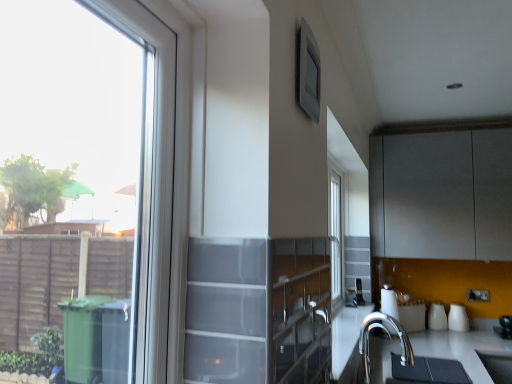
Measure the distance between matte gray cabinet at upper right and camera.

A distance of 2.88 meters exists between matte gray cabinet at upper right and camera.

What do you see at coordinates (359, 292) in the screenshot? I see `satin silver toaster at lower center, acting as the 3th appliance starting from the right` at bounding box center [359, 292].

At what (x,y) coordinates should I click in order to perform the action: click on polished chrome faucet at lower right. Please return your answer as a coordinate pair (x, y). Image resolution: width=512 pixels, height=384 pixels. Looking at the image, I should click on (389, 335).

Describe the element at coordinates (308, 72) in the screenshot. I see `matte gray window screen at upper center` at that location.

From the picture: How much space does white glossy vase at right, marked as the first appliance in a right-to-left arrangement, occupy vertically?

It is 8.68 inches.

What are the coordinates of `matte gray cabinet at upper right` in the screenshot? It's located at (442, 190).

Is matte gray window screen at upper center directly adjacent to white glossy vase at right, the 3th appliance when ordered from left to right?

No, matte gray window screen at upper center is not making contact with white glossy vase at right, the 3th appliance when ordered from left to right.

Could you tell me if matte gray window screen at upper center is turned towards white glossy vase at right, the 3th appliance when ordered from left to right?

No, matte gray window screen at upper center is not aimed at white glossy vase at right, the 3th appliance when ordered from left to right.

From a real-world perspective, is matte gray window screen at upper center positioned over white glossy vase at right, marked as the first appliance in a right-to-left arrangement, based on gravity?

Correct, in the physical world, matte gray window screen at upper center is higher than white glossy vase at right, marked as the first appliance in a right-to-left arrangement.

Considering the relative sizes of matte gray window screen at upper center and white glossy vase at right, marked as the first appliance in a right-to-left arrangement, in the image provided, is matte gray window screen at upper center wider than white glossy vase at right, marked as the first appliance in a right-to-left arrangement,?

No.

Between satin silver toaster at lower center, which is the 1th appliance from left to right, and clear glass window at left, which one has less height?

With less height is satin silver toaster at lower center, which is the 1th appliance from left to right.

Does satin silver toaster at lower center, acting as the 3th appliance starting from the right, come behind clear glass window at left?

Yes, it is behind clear glass window at left.

From the image's perspective, which one is positioned higher, satin silver toaster at lower center, which is the 1th appliance from left to right, or clear glass window at left?

clear glass window at left.

Is satin silver toaster at lower center, which is the 1th appliance from left to right, at the right side of clear glass window at left?

Yes, satin silver toaster at lower center, which is the 1th appliance from left to right, is to the right of clear glass window at left.

From a real-world perspective, between white glossy cups at lower right, placed as the second appliance when sorted from right to left, and satin silver toaster at lower center, acting as the 3th appliance starting from the right, who is vertically lower?

white glossy cups at lower right, placed as the second appliance when sorted from right to left, is physically lower.

Between white glossy cups at lower right, placed as the second appliance when sorted from right to left, and satin silver toaster at lower center, which is the 1th appliance from left to right, which one has larger width?

white glossy cups at lower right, placed as the second appliance when sorted from right to left.

Is white glossy cups at lower right, placed as the second appliance when sorted from right to left, not near satin silver toaster at lower center, acting as the 3th appliance starting from the right?

No.

Would you say white glossy cups at lower right, placed as the second appliance when sorted from right to left, contains satin silver toaster at lower center, which is the 1th appliance from left to right?

No, satin silver toaster at lower center, which is the 1th appliance from left to right, is not surrounded by white glossy cups at lower right, placed as the second appliance when sorted from right to left.

Between clear glass window at left and matte gray window screen at upper center, which one has larger width?

With larger width is clear glass window at left.

From a real-world perspective, does clear glass window at left sit lower than matte gray window screen at upper center?

Correct, in the physical world, clear glass window at left is lower than matte gray window screen at upper center.

Is clear glass window at left taller or shorter than matte gray window screen at upper center?

Considering their sizes, clear glass window at left has more height than matte gray window screen at upper center.

Is clear glass window at left next to matte gray window screen at upper center?

They are not placed beside each other.

Does white glossy vase at right, the 3th appliance when ordered from left to right, have a larger size compared to matte gray window screen at upper center?

Yes.

How different are the orientations of white glossy vase at right, the 3th appliance when ordered from left to right, and matte gray window screen at upper center in degrees?

91.2 degrees separate the facing orientations of white glossy vase at right, the 3th appliance when ordered from left to right, and matte gray window screen at upper center.

Which object is positioned more to the right, white glossy vase at right, the 3th appliance when ordered from left to right, or matte gray window screen at upper center?

white glossy vase at right, the 3th appliance when ordered from left to right.

Would you say white glossy vase at right, the 3th appliance when ordered from left to right, is inside or outside matte gray window screen at upper center?

white glossy vase at right, the 3th appliance when ordered from left to right, is spatially situated outside matte gray window screen at upper center.

Is satin silver toaster at lower center, which is the 1th appliance from left to right, bigger than white glossy vase at right, marked as the first appliance in a right-to-left arrangement?

Incorrect, satin silver toaster at lower center, which is the 1th appliance from left to right, is not larger than white glossy vase at right, marked as the first appliance in a right-to-left arrangement.

This screenshot has width=512, height=384. I want to click on appliance in front of the white glossy vase at right, the 3th appliance when ordered from left to right, so click(x=359, y=292).

Is satin silver toaster at lower center, which is the 1th appliance from left to right, facing towards white glossy vase at right, marked as the first appliance in a right-to-left arrangement?

No, satin silver toaster at lower center, which is the 1th appliance from left to right, is not aimed at white glossy vase at right, marked as the first appliance in a right-to-left arrangement.

In the scene shown: Is satin silver toaster at lower center, acting as the 3th appliance starting from the right, inside the boundaries of white glossy vase at right, marked as the first appliance in a right-to-left arrangement, or outside?

satin silver toaster at lower center, acting as the 3th appliance starting from the right, lies outside white glossy vase at right, marked as the first appliance in a right-to-left arrangement.

Does satin silver toaster at lower center, which is the 1th appliance from left to right, have a lesser height compared to white glossy cups at lower right, marked as the second appliance in a left-to-right arrangement?

Correct, satin silver toaster at lower center, which is the 1th appliance from left to right, is not as tall as white glossy cups at lower right, marked as the second appliance in a left-to-right arrangement.

Is white glossy cups at lower right, placed as the second appliance when sorted from right to left, completely or partially inside satin silver toaster at lower center, acting as the 3th appliance starting from the right?

No, satin silver toaster at lower center, acting as the 3th appliance starting from the right, does not contain white glossy cups at lower right, placed as the second appliance when sorted from right to left.

Can you tell me how much satin silver toaster at lower center, acting as the 3th appliance starting from the right, and white glossy cups at lower right, marked as the second appliance in a left-to-right arrangement, differ in facing direction?

The angle between the facing direction of satin silver toaster at lower center, acting as the 3th appliance starting from the right, and the facing direction of white glossy cups at lower right, marked as the second appliance in a left-to-right arrangement, is 72 degrees.

Is satin silver toaster at lower center, acting as the 3th appliance starting from the right, smaller than white glossy cups at lower right, marked as the second appliance in a left-to-right arrangement?

Yes, satin silver toaster at lower center, acting as the 3th appliance starting from the right, is smaller than white glossy cups at lower right, marked as the second appliance in a left-to-right arrangement.

Identify the location of the 2nd appliance behind the matte gray window screen at upper center, starting your count from the anchor. This screenshot has height=384, width=512. pos(458,318).

Locate an element on the screen. window in front of the satin silver toaster at lower center, which is the 1th appliance from left to right is located at coordinates (96, 126).

When comparing their distances from white glossy cups at lower right, marked as the second appliance in a left-to-right arrangement, does matte gray window screen at upper center or polished chrome faucet at lower right seem further?

Based on the image, matte gray window screen at upper center appears to be further to white glossy cups at lower right, marked as the second appliance in a left-to-right arrangement.

When comparing their distances from satin silver toaster at lower center, acting as the 3th appliance starting from the right, does polished chrome faucet at lower right or white glossy vase at right, the 3th appliance when ordered from left to right, seem closer?

Among the two, polished chrome faucet at lower right is located nearer to satin silver toaster at lower center, acting as the 3th appliance starting from the right.

Which object lies nearer to the anchor point polished chrome faucet at lower right, white glossy cups at lower right, placed as the second appliance when sorted from right to left, or white glossy vase at right, marked as the first appliance in a right-to-left arrangement?

Among the two, white glossy cups at lower right, placed as the second appliance when sorted from right to left, is located nearer to polished chrome faucet at lower right.

Looking at the image, which one is located further to white glossy cups at lower right, placed as the second appliance when sorted from right to left, clear glass window at left or white glossy vase at right, the 3th appliance when ordered from left to right?

clear glass window at left.

From the image, which object appears to be farther from matte gray window screen at upper center, clear glass window at left or white glossy cups at lower right, placed as the second appliance when sorted from right to left?

The object further to matte gray window screen at upper center is white glossy cups at lower right, placed as the second appliance when sorted from right to left.

Estimate the real-world distances between objects in this image. Which object is closer to polished chrome faucet at lower right, matte gray window screen at upper center or white glossy vase at right, marked as the first appliance in a right-to-left arrangement?

white glossy vase at right, marked as the first appliance in a right-to-left arrangement.

From the image, which object appears to be nearer to white glossy cups at lower right, marked as the second appliance in a left-to-right arrangement, white glossy vase at right, marked as the first appliance in a right-to-left arrangement, or polished chrome faucet at lower right?

The object closer to white glossy cups at lower right, marked as the second appliance in a left-to-right arrangement, is white glossy vase at right, marked as the first appliance in a right-to-left arrangement.

Which object lies further to the anchor point matte gray cabinet at upper right, clear glass window at left or polished chrome faucet at lower right?

clear glass window at left is further to matte gray cabinet at upper right.

This screenshot has width=512, height=384. I want to click on window screen between clear glass window at left and white glossy cups at lower right, marked as the second appliance in a left-to-right arrangement, in the front-back direction, so click(x=308, y=72).

Locate an element on the screen. The image size is (512, 384). appliance situated between satin silver toaster at lower center, which is the 1th appliance from left to right, and white glossy vase at right, marked as the first appliance in a right-to-left arrangement, from left to right is located at coordinates (437, 317).

Where is `tap positioned between matte gray window screen at upper center and satin silver toaster at lower center, which is the 1th appliance from left to right, from near to far`? Image resolution: width=512 pixels, height=384 pixels. tap positioned between matte gray window screen at upper center and satin silver toaster at lower center, which is the 1th appliance from left to right, from near to far is located at coordinates (389, 335).

You are a GUI agent. You are given a task and a screenshot of the screen. Output one action in this format:
    pyautogui.click(x=<x>, y=<y>)
    Task: Click on the cabinetry positioned between polished chrome faucet at lower right and satin silver toaster at lower center, acting as the 3th appliance starting from the right, from near to far
    
    Given the screenshot: What is the action you would take?
    (442, 190)